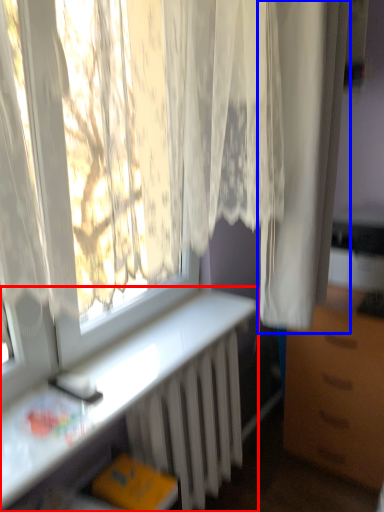
Question: Which object appears farthest to the camera in this image, desk (highlighted by a red box) or curtain (highlighted by a blue box)?

Choices:
 (A) desk
 (B) curtain

Answer: (B)